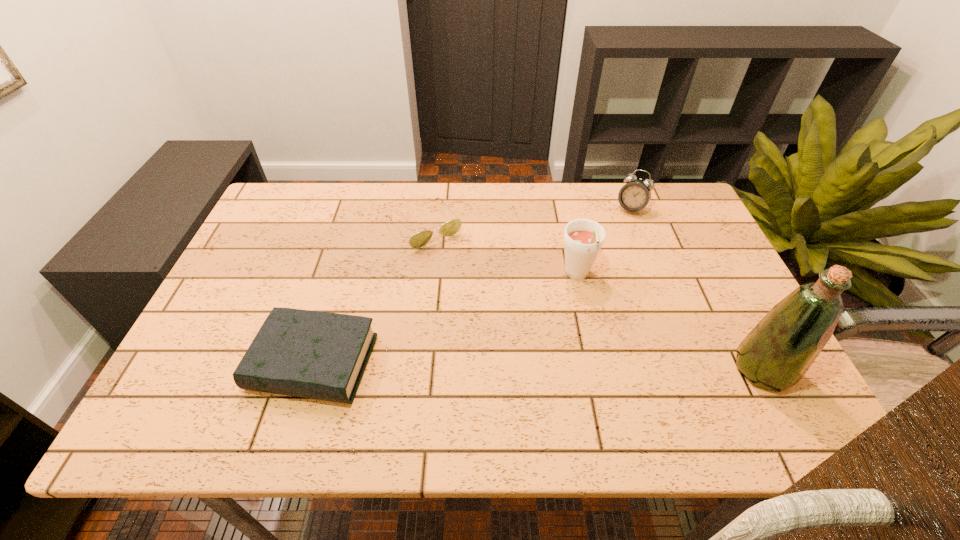
Find the location of a particular element. Bible is located at coordinates (318, 355).

What are the coordinates of `the rightmost object` in the screenshot? It's located at (776, 354).

The image size is (960, 540). Identify the location of olive oil. (776, 354).

Locate an element on the screen. the third object from left to right is located at coordinates (583, 238).

The width and height of the screenshot is (960, 540). Find the location of `root beer`. root beer is located at coordinates (583, 238).

This screenshot has width=960, height=540. In order to click on sunglasses in this screenshot , I will do `click(419, 240)`.

The image size is (960, 540). I want to click on alarm clock, so 634,196.

You are a GUI agent. You are given a task and a screenshot of the screen. Output one action in this format:
    pyautogui.click(x=<x>, y=<y>)
    Task: Click on the second object from right to left
    
    Given the screenshot: What is the action you would take?
    pyautogui.click(x=634, y=196)

In order to click on free space located on the back of the Bible in this screenshot , I will do `click(345, 262)`.

Image resolution: width=960 pixels, height=540 pixels. Identify the location of vacant space located on the drink side of the third object from right to left. (581, 323).